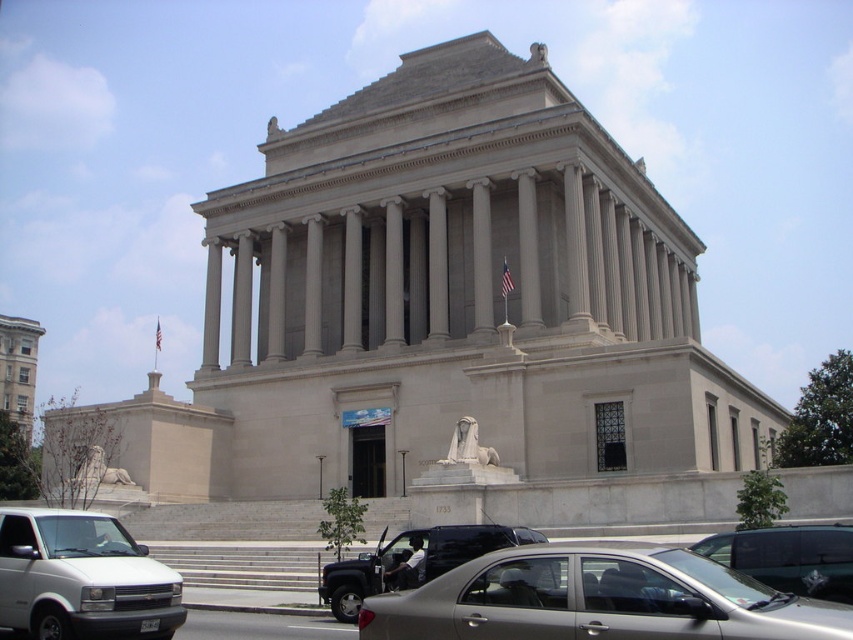
You are standing at the point marked as point (32, 620) in front of the grand neoclassical building. If you want to take a photo of the building from your current position, will the entire building fit in the frame of a standard smartphone camera with a 60 degree field of view?

The point (32, 620) is 94.35 feet away from the camera. To determine if the entire building fits in the frame, we need to calculate the angular width of the building at that distance. Assuming a standard smartphone camera has a 60 degree field of view, the maximum angular width it can capture is 60 degrees. The building spans a certain width, so we can calculate its angular width using trigonometry. If the angular width of the building is less than or equal to 60 degrees, it will fit. However, without an

You are a delivery driver who needs to park your metallic silver van at center without blocking the gray stone lion at center. Based on the scene described, is this possible?

The metallic silver van at center is currently in front of the gray stone lion at center, meaning it is blocking it. To park without blocking, the van should be positioned behind or to the side of the lion so it doesn not obstruct the view or access to the statue.